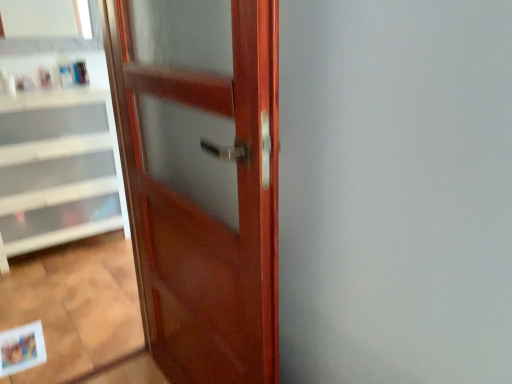
Question: From the image's perspective, is translucent plastic bottle at upper left, the 2th toiletry in the right-to-left sequence, below matte paper postcard at lower left?

Choices:
 (A) no
 (B) yes

Answer: (A)

Question: From a real-world perspective, is translucent plastic bottle at upper left, which ranks as the second toiletry in left-to-right order, positioned under matte paper postcard at lower left based on gravity?

Choices:
 (A) yes
 (B) no

Answer: (B)

Question: Is translucent plastic bottle at upper left, the 2th toiletry in the right-to-left sequence, outside of matte paper postcard at lower left?

Choices:
 (A) yes
 (B) no

Answer: (A)

Question: Can you confirm if translucent plastic bottle at upper left, the 2th toiletry in the right-to-left sequence, is smaller than matte paper postcard at lower left?

Choices:
 (A) yes
 (B) no

Answer: (A)

Question: Can you confirm if translucent plastic bottle at upper left, the 2th toiletry in the right-to-left sequence, is positioned to the right of matte paper postcard at lower left?

Choices:
 (A) no
 (B) yes

Answer: (A)

Question: Is translucent plastic bottle at upper left, which ranks as the second toiletry in left-to-right order, oriented towards matte paper postcard at lower left?

Choices:
 (A) no
 (B) yes

Answer: (A)

Question: Are matte paper postcard at lower left and translucent plastic bottle at upper left, which ranks as the second toiletry in left-to-right order, beside each other?

Choices:
 (A) no
 (B) yes

Answer: (A)

Question: From the image's perspective, would you say matte paper postcard at lower left is positioned over translucent plastic bottle at upper left, the 2th toiletry in the right-to-left sequence?

Choices:
 (A) yes
 (B) no

Answer: (B)

Question: From a real-world perspective, is matte paper postcard at lower left over translucent plastic bottle at upper left, which ranks as the second toiletry in left-to-right order?

Choices:
 (A) yes
 (B) no

Answer: (B)

Question: From the image's perspective, is matte paper postcard at lower left below translucent plastic bottle at upper left, which ranks as the second toiletry in left-to-right order?

Choices:
 (A) yes
 (B) no

Answer: (A)

Question: Does matte paper postcard at lower left have a greater width compared to translucent plastic bottle at upper left, which ranks as the second toiletry in left-to-right order?

Choices:
 (A) yes
 (B) no

Answer: (A)

Question: Is matte paper postcard at lower left oriented towards translucent plastic bottle at upper left, which ranks as the second toiletry in left-to-right order?

Choices:
 (A) yes
 (B) no

Answer: (B)

Question: From the image's perspective, is matte plastic bottle at upper left, the first toiletry viewed from the right, under translucent plastic bottle at upper left, which ranks as the second toiletry in left-to-right order?

Choices:
 (A) yes
 (B) no

Answer: (B)